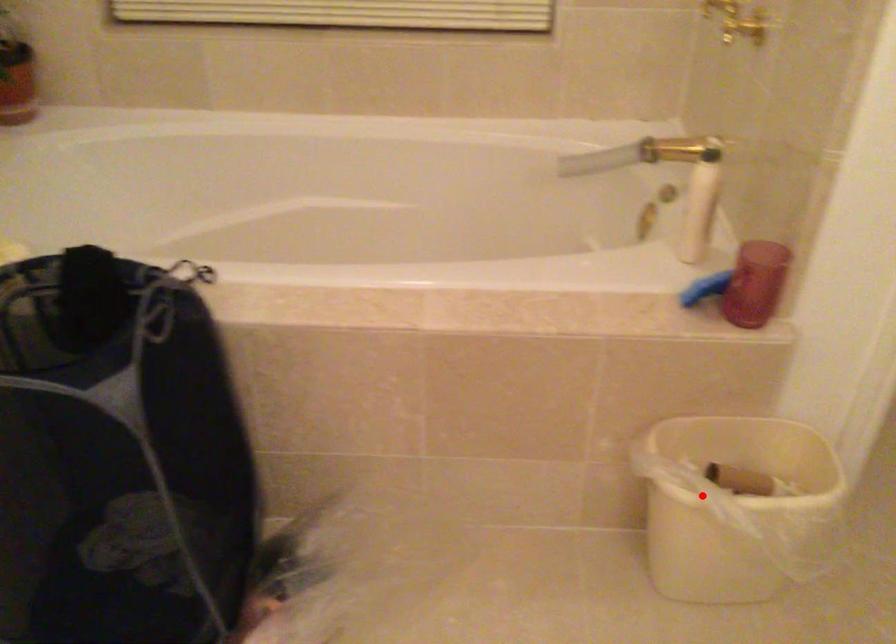
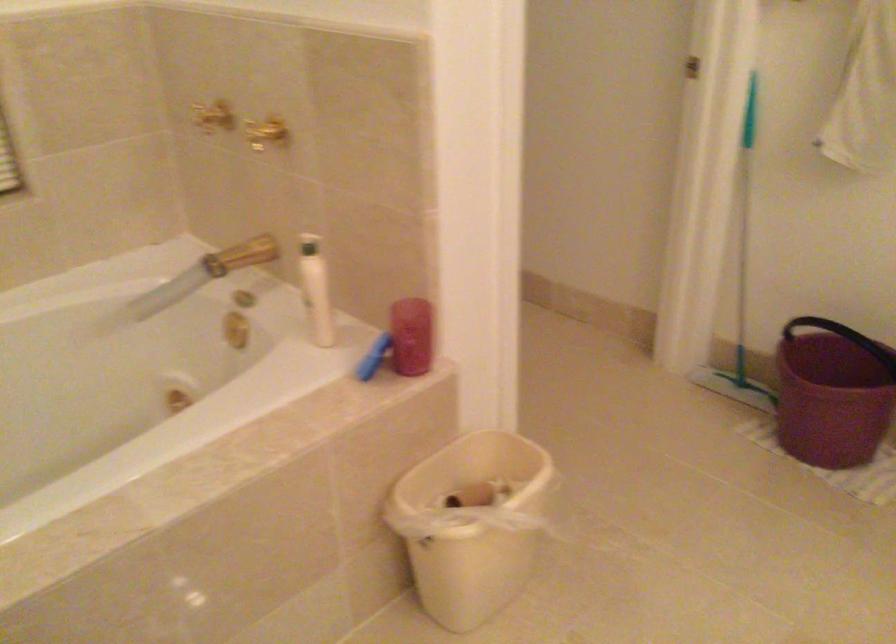
Question: I am providing you with two images of the same scene from different viewpoints. Given a red point in image1, look at the same physical point in image2. Is it:

Choices:
 (A) Closer to the viewpoint
 (B) Farther from the viewpoint

Answer: (B)